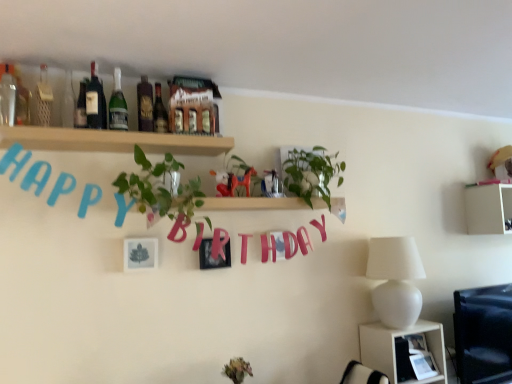
What do you see at coordinates (81, 107) in the screenshot?
I see `green glass bottle at upper left, the 5th bottle in the right-to-left sequence` at bounding box center [81, 107].

This screenshot has height=384, width=512. Describe the element at coordinates (395, 280) in the screenshot. I see `white matte lamp at right` at that location.

What is the approximate width of matte glass bottle at upper left, marked as the first bottle in a left-to-right arrangement?

The width of matte glass bottle at upper left, marked as the first bottle in a left-to-right arrangement, is 2.09 inches.

How much space does matte glass bottle at upper center, marked as the 7th bottle in a left-to-right arrangement, occupy vertically?

matte glass bottle at upper center, marked as the 7th bottle in a left-to-right arrangement, is 11.38 inches in height.

What do you see at coordinates (211, 255) in the screenshot?
I see `metallic silver photo frame at center, the 2th picture frame from the left` at bounding box center [211, 255].

You are a GUI agent. You are given a task and a screenshot of the screen. Output one action in this format:
    pyautogui.click(x=<x>, y=<y>)
    Task: Click on the metallic silver photo frame at center, which is the first picture frame from right to left
    The height and width of the screenshot is (384, 512).
    Given the screenshot: What is the action you would take?
    pyautogui.click(x=211, y=255)

In order to face matte red horse at center, should I rotate leftwards or rightwards?

To face it directly, rotate left by 4.102 degrees.

Image resolution: width=512 pixels, height=384 pixels. What do you see at coordinates (112, 140) in the screenshot? I see `wooden shelf at upper center, the third shelf from the right` at bounding box center [112, 140].

Measure the distance between point (197, 136) and camera.

Point (197, 136) and camera are 6.71 feet apart.

At what (x,y) coordinates should I click in order to perform the action: click on clear glass bottle at upper left, acting as the sixth bottle starting from the right. Please return your answer as a coordinate pair (x, y). The image size is (512, 384). Looking at the image, I should click on (42, 99).

At what (x,y) coordinates should I click in order to perform the action: click on the 2nd bottle to the right of the green glass bottle at upper center, which appears as the third bottle when viewed from the right, starting your count from the anchor. Please return your answer as a coordinate pair (x, y). This screenshot has height=384, width=512. Looking at the image, I should click on (159, 112).

Between matte glass bottle at upper center, the first bottle viewed from the right, and green glass bottle at upper center, which is counted as the 5th bottle, starting from the left, which one has smaller width?

Thinner between the two is green glass bottle at upper center, which is counted as the 5th bottle, starting from the left.

Based on the photo, from the image's perspective, is matte glass bottle at upper center, the first bottle viewed from the right, on top of green glass bottle at upper center, which is counted as the 5th bottle, starting from the left?

No, from the image's perspective, matte glass bottle at upper center, the first bottle viewed from the right, is not above green glass bottle at upper center, which is counted as the 5th bottle, starting from the left.

In the scene shown: In terms of height, does matte glass bottle at upper center, the first bottle viewed from the right, look taller or shorter compared to green glass bottle at upper center, which is counted as the 5th bottle, starting from the left?

Clearly, matte glass bottle at upper center, the first bottle viewed from the right, is shorter compared to green glass bottle at upper center, which is counted as the 5th bottle, starting from the left.

Locate an element on the screen. The image size is (512, 384). houseplant below the green glass bottle at upper center, which appears as the third bottle when viewed from the right (from a real-world perspective) is located at coordinates (159, 188).

From the image's perspective, is green leafy plant at center on top of green glass bottle at upper center, which appears as the third bottle when viewed from the right?

No, from the image's perspective, green leafy plant at center is not above green glass bottle at upper center, which appears as the third bottle when viewed from the right.

Can you confirm if green leafy plant at center is shorter than green glass bottle at upper center, which is counted as the 5th bottle, starting from the left?

Incorrect, the height of green leafy plant at center does not fall short of that of green glass bottle at upper center, which is counted as the 5th bottle, starting from the left.

How many degrees apart are the facing directions of green leafy plant at center and green glass bottle at upper center, which is counted as the 5th bottle, starting from the left?

There is a 0.000516-degree angle between the facing directions of green leafy plant at center and green glass bottle at upper center, which is counted as the 5th bottle, starting from the left.

Would you consider white matte lamp at right to be distant from matte glass bottle at upper left, marked as the first bottle in a left-to-right arrangement?

Yes.

Is point (396, 242) more distant than point (1, 87)?

Yes, it is behind point (1, 87).

How different are the orientations of white matte lamp at right and matte glass bottle at upper left, the 7th bottle in the right-to-left sequence, in degrees?

The angle between the facing direction of white matte lamp at right and the facing direction of matte glass bottle at upper left, the 7th bottle in the right-to-left sequence, is 0.83 degrees.

You are a GUI agent. You are given a task and a screenshot of the screen. Output one action in this format:
    pyautogui.click(x=<x>, y=<y>)
    Task: Click on the lamp lying on the right of matte glass bottle at upper left, the 7th bottle in the right-to-left sequence
    This screenshot has width=512, height=384.
    Given the screenshot: What is the action you would take?
    pyautogui.click(x=395, y=280)

Is matte glass bottle at upper center, marked as the 7th bottle in a left-to-right arrangement, inside the boundaries of green glossy plant at upper center, or outside?

matte glass bottle at upper center, marked as the 7th bottle in a left-to-right arrangement, is outside green glossy plant at upper center.

Which is closer to the camera, (167, 116) or (312, 154)?

Point (167, 116).

From a real-world perspective, between matte glass bottle at upper center, marked as the 7th bottle in a left-to-right arrangement, and green glossy plant at upper center, who is vertically higher?

matte glass bottle at upper center, marked as the 7th bottle in a left-to-right arrangement.

Considering the positions of objects matte glass bottle at upper center, marked as the 7th bottle in a left-to-right arrangement, and green glossy plant at upper center in the image provided, who is behind, matte glass bottle at upper center, marked as the 7th bottle in a left-to-right arrangement, or green glossy plant at upper center?

Positioned behind is green glossy plant at upper center.

Is matte glass bottle at upper left, marked as the first bottle in a left-to-right arrangement, to the left of matte glass bottle at upper center, marked as the 7th bottle in a left-to-right arrangement, from the viewer's perspective?

Yes.

Consider the image. Between matte glass bottle at upper left, the 7th bottle in the right-to-left sequence, and matte glass bottle at upper center, marked as the 7th bottle in a left-to-right arrangement, which one is positioned in front?

matte glass bottle at upper left, the 7th bottle in the right-to-left sequence.

The height and width of the screenshot is (384, 512). I want to click on the 6th bottle in front of the matte glass bottle at upper center, marked as the 7th bottle in a left-to-right arrangement, counting from the anchor's position, so click(8, 93).

Can you confirm if white glossy shelf at upper right, marked as the first shelf in a back-to-front arrangement, is smaller than matte glass bottle at upper center, placed as the second bottle when sorted from right to left?

No.

From the image's perspective, starting from the matte glass bottle at upper center, placed as the second bottle when sorted from right to left, which shelf is the 2nd one below? Please provide its 2D coordinates.

[(488, 209)]

Which object is closer to the camera taking this photo, white glossy shelf at upper right, placed as the 3th shelf when sorted from front to back, or matte glass bottle at upper center, placed as the second bottle when sorted from right to left?

matte glass bottle at upper center, placed as the second bottle when sorted from right to left, is closer to the camera.

Can you confirm if white matte lamp at right is taller than green glass bottle at upper center, which is counted as the 5th bottle, starting from the left?

Yes.

Is point (393, 265) behind point (119, 107)?

Yes.

Measure the distance between white matte lamp at right and green glass bottle at upper center, which is counted as the 5th bottle, starting from the left.

5.61 feet.

Is white matte lamp at right not near green glass bottle at upper center, which is counted as the 5th bottle, starting from the left?

Indeed, white matte lamp at right is not near green glass bottle at upper center, which is counted as the 5th bottle, starting from the left.

You are a GUI agent. You are given a task and a screenshot of the screen. Output one action in this format:
    pyautogui.click(x=<x>, y=<y>)
    Task: Click on the 2nd bottle counting from the right of the green glass bottle at upper center, which appears as the third bottle when viewed from the right
    This screenshot has height=384, width=512.
    Given the screenshot: What is the action you would take?
    pyautogui.click(x=159, y=112)

Where is `the 6th bottle above when counting from the green leafy plant at center (from the image's perspective)`? The image size is (512, 384). the 6th bottle above when counting from the green leafy plant at center (from the image's perspective) is located at coordinates (118, 105).

Based on their spatial positions, is white matte lamp at right or green glass bottle at upper center, which is counted as the 5th bottle, starting from the left, further from matte glass bottle at upper center, the first bottle viewed from the right?

The object further to matte glass bottle at upper center, the first bottle viewed from the right, is white matte lamp at right.

Based on their spatial positions, is green glass bottle at upper left, marked as the third bottle in a left-to-right arrangement, or green glossy plant at upper center further from matte red horse at center?

green glass bottle at upper left, marked as the third bottle in a left-to-right arrangement, is positioned further to the anchor matte red horse at center.

Which object lies further to the anchor point matte glass bottle at upper center, the first bottle viewed from the right, matte glass bottle at upper center, placed as the second bottle when sorted from right to left, or dark brown glass bottle at upper left, acting as the 4th bottle starting from the left?

dark brown glass bottle at upper left, acting as the 4th bottle starting from the left, is positioned further to the anchor matte glass bottle at upper center, the first bottle viewed from the right.

Estimate the real-world distances between objects in this image. Which object is further from matte glass bottle at upper left, marked as the first bottle in a left-to-right arrangement, clear glass bottle at upper left, the 2th bottle viewed from the left, or white matte lamp at right?

Among the two, white matte lamp at right is located further to matte glass bottle at upper left, marked as the first bottle in a left-to-right arrangement.

Which object lies nearer to the anchor point green glass bottle at upper center, which appears as the third bottle when viewed from the right, white matte shelf at lower right, the 2th shelf from the right, or green leafy plant at center?

green leafy plant at center lies closer to green glass bottle at upper center, which appears as the third bottle when viewed from the right, than the other object.

Considering their positions, is white matte shelf at lower right, the 2th shelf from the right, positioned further to green glossy plant at upper center than matte glass bottle at upper left, the 7th bottle in the right-to-left sequence?

matte glass bottle at upper left, the 7th bottle in the right-to-left sequence, is further to green glossy plant at upper center.

From the image, which object appears to be farther from matte glass bottle at upper center, placed as the second bottle when sorted from right to left, white matte lamp at right or matte red horse at center?

white matte lamp at right is further to matte glass bottle at upper center, placed as the second bottle when sorted from right to left.

Consider the image. Considering their positions, is metallic silver photo frame at center, the 2th picture frame from the left, positioned further to wooden shelf at upper center, the 3th shelf in the back-to-front sequence, than clear glass bottle at upper left, the 2th bottle viewed from the left?

metallic silver photo frame at center, the 2th picture frame from the left, lies further to wooden shelf at upper center, the 3th shelf in the back-to-front sequence, than the other object.

The height and width of the screenshot is (384, 512). I want to click on toy between dark brown glass bottle at upper left, acting as the 4th bottle starting from the left, and white glossy shelf at upper right, marked as the first shelf in a back-to-front arrangement, from left to right, so click(x=224, y=183).

This screenshot has height=384, width=512. Find the location of `houseplant between dark brown glass bottle at upper left, acting as the 4th bottle starting from the left, and matte red horse at center, in the horizontal direction`. houseplant between dark brown glass bottle at upper left, acting as the 4th bottle starting from the left, and matte red horse at center, in the horizontal direction is located at coordinates (159, 188).

This screenshot has width=512, height=384. Identify the location of lamp between green glass bottle at upper left, marked as the third bottle in a left-to-right arrangement, and white matte shelf at lower right, which ranks as the second shelf in back-to-front order. (x=395, y=280).

The width and height of the screenshot is (512, 384). I want to click on shelf between metallic silver picture frame at center, arranged as the first picture frame when viewed from the front, and white glossy shelf at upper right, marked as the first shelf in a back-to-front arrangement, in the horizontal direction, so click(394, 347).